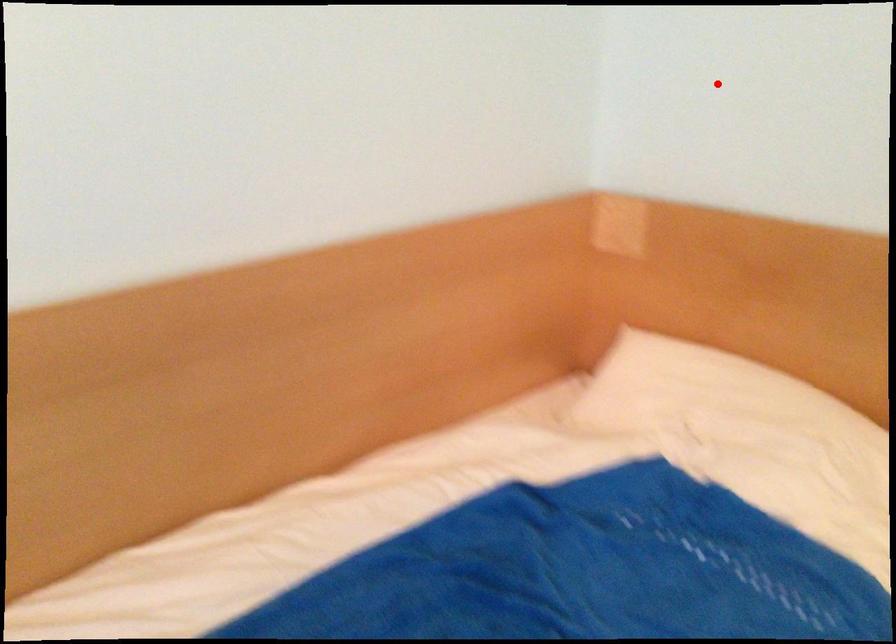
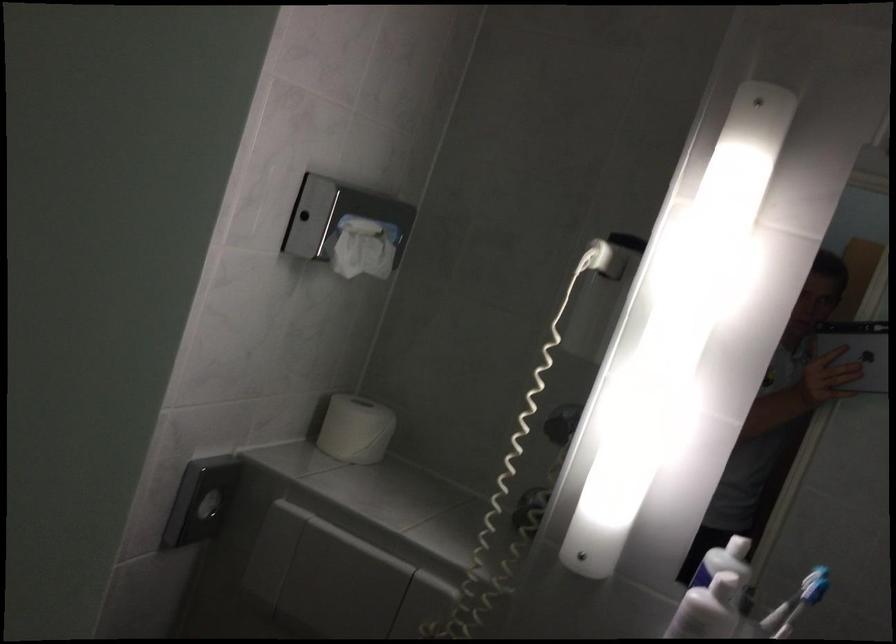
Locate, in the second image, the point that corresponds to the highlighted location in the first image.

(355, 429)